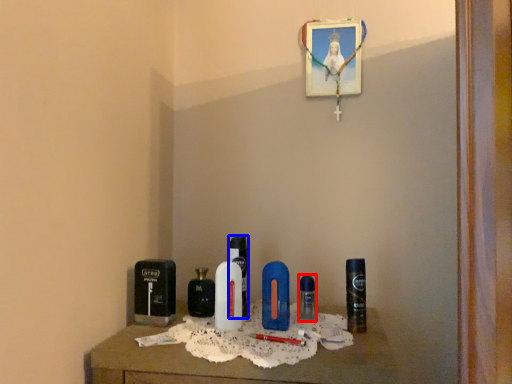
Question: Which object is closer to the camera taking this photo, perfume (highlighted by a red box) or perfume (highlighted by a blue box)?

Choices:
 (A) perfume
 (B) perfume

Answer: (B)